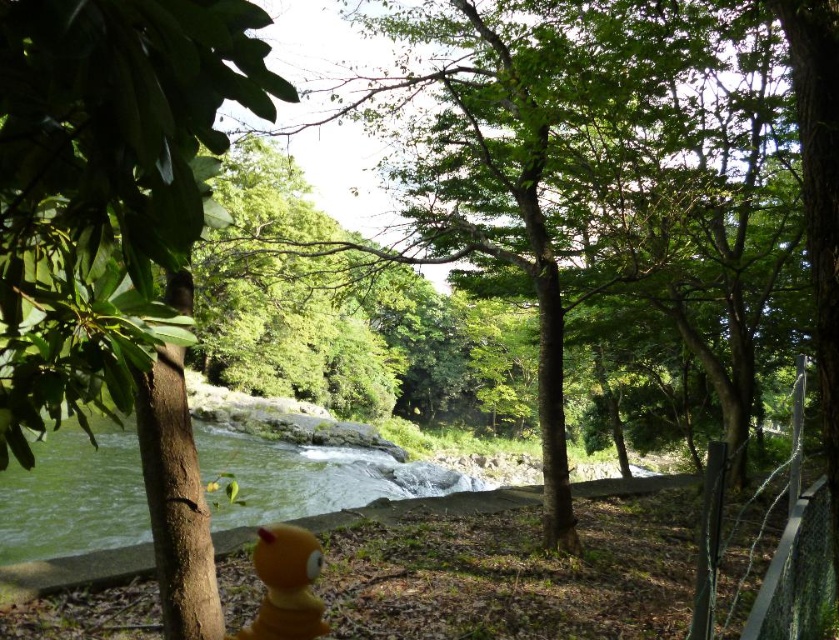
Question: Does green liquid water at center have a lesser width compared to black wire mesh at right?

Choices:
 (A) no
 (B) yes

Answer: (A)

Question: Which object is farther from the camera taking this photo?

Choices:
 (A) yellow rubber duck at lower center
 (B) black wire mesh at right

Answer: (B)

Question: Can you confirm if black wire mesh at right is bigger than yellow rubber duck at lower center?

Choices:
 (A) yes
 (B) no

Answer: (A)

Question: Which point appears farthest from the camera in this image?

Choices:
 (A) (9, 509)
 (B) (702, 605)
 (C) (316, 557)

Answer: (A)

Question: Which point is closer to the camera taking this photo?

Choices:
 (A) (774, 604)
 (B) (81, 490)
 (C) (305, 532)

Answer: (C)

Question: Does green liquid water at center appear under black wire mesh at right?

Choices:
 (A) yes
 (B) no

Answer: (A)